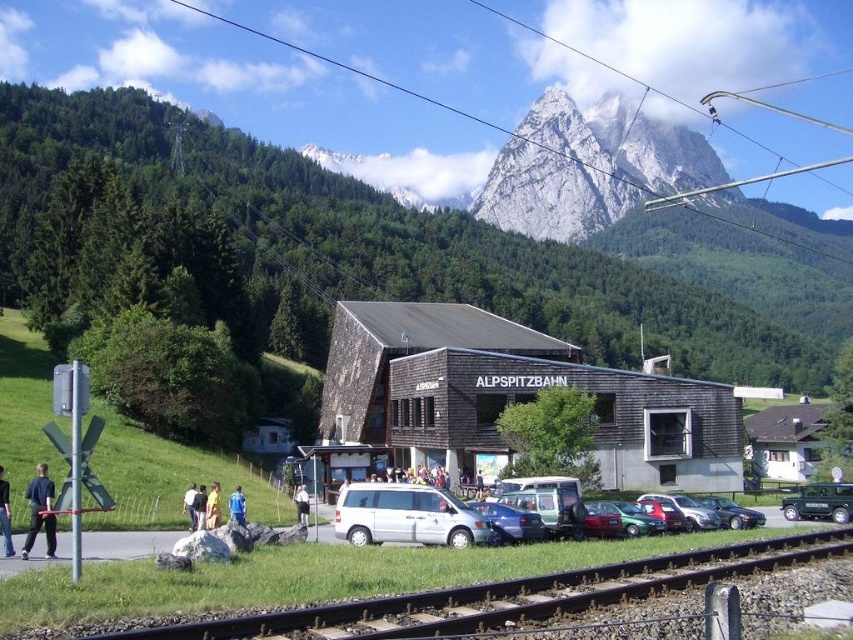
Who is taller, silver metallic van at center or light brown leather jacket at lower center?

Standing taller between the two is silver metallic van at center.

Locate an element on the screen. Image resolution: width=853 pixels, height=640 pixels. silver metallic van at center is located at coordinates (405, 515).

What do you see at coordinates (405, 515) in the screenshot?
I see `silver metallic van at center` at bounding box center [405, 515].

This screenshot has height=640, width=853. Identify the location of silver metallic van at center. (405, 515).

Is the position of black asphalt train track at lower center less distant than that of metallic green car at center?

That is True.

Can you confirm if black asphalt train track at lower center is bigger than metallic green car at center?

Yes.

In order to click on black asphalt train track at lower center in this screenshot , I will do `click(514, 595)`.

You are a GUI agent. You are given a task and a screenshot of the screen. Output one action in this format:
    pyautogui.click(x=<x>, y=<y>)
    Task: Click on the black asphalt train track at lower center
    This screenshot has width=853, height=640.
    Given the screenshot: What is the action you would take?
    pyautogui.click(x=514, y=595)

Measure the distance between point (735,552) and camera.

They are 38.19 meters apart.

Who is more forward, (135, 634) or (410, 541)?

Point (135, 634)

Find the location of `black asphalt train track at lower center`. black asphalt train track at lower center is located at coordinates (514, 595).